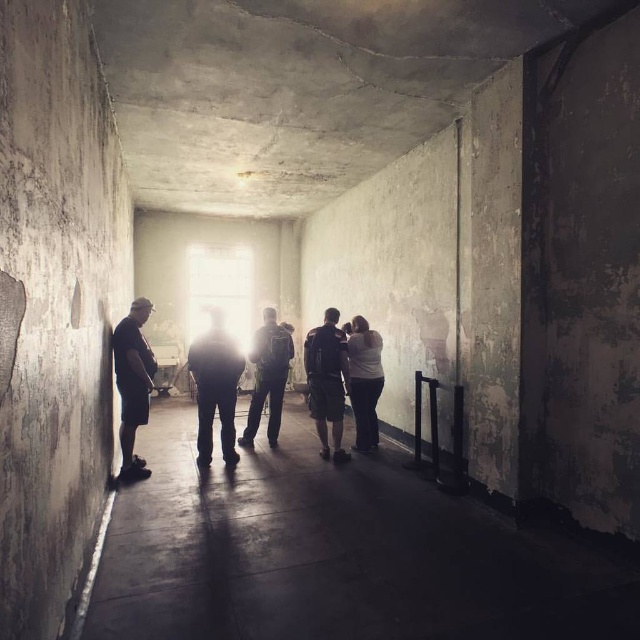
Question: Among these points, which one is farthest from the camera?

Choices:
 (A) (320, 400)
 (B) (225, 403)

Answer: (A)

Question: Which object is closer to the camera taking this photo?

Choices:
 (A) white matte shirt at center
 (B) dark gray fabric backpack at center
 (C) concrete floor at center

Answer: (C)

Question: Does dark gray fabric backpack at center have a smaller size compared to matte green backpack at center?

Choices:
 (A) no
 (B) yes

Answer: (B)

Question: Among these objects, which one is nearest to the camera?

Choices:
 (A) matte green backpack at center
 (B) concrete floor at center
 (C) dark gray fabric backpack at center
 (D) white matte shirt at center

Answer: (B)

Question: Is concrete floor at center to the right of dark gray fabric backpack at center from the viewer's perspective?

Choices:
 (A) no
 (B) yes

Answer: (B)

Question: Does dark gray fabric pants at center appear on the left side of dark gray fabric backpack at center?

Choices:
 (A) yes
 (B) no

Answer: (A)